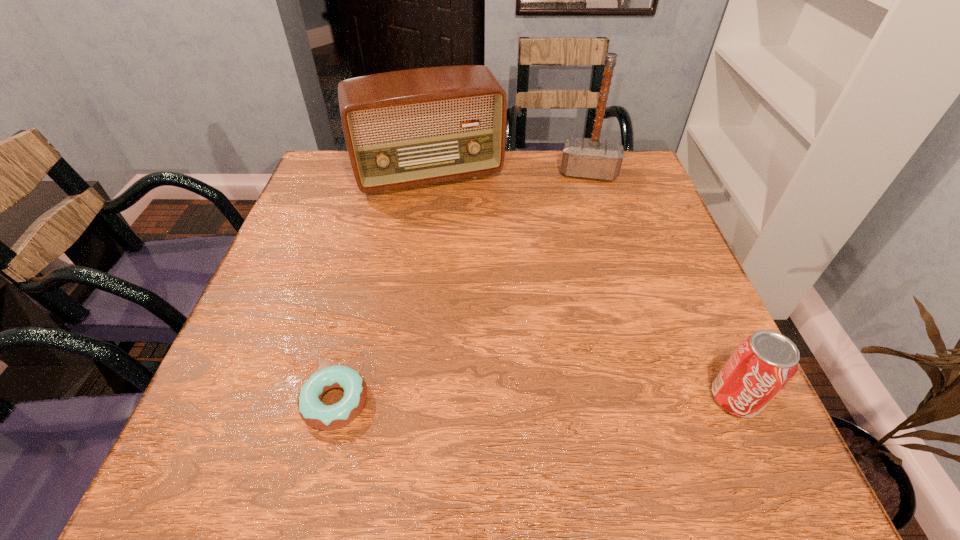
Where is `vacant spot on the desktop that is between the doughnut and the rightmost object and is positioned on the striking surface of the second object from right to left`? vacant spot on the desktop that is between the doughnut and the rightmost object and is positioned on the striking surface of the second object from right to left is located at coordinates [581, 400].

Locate an element on the screen. Image resolution: width=960 pixels, height=540 pixels. free space on the desktop that is between the shortest object and the rightmost object and is positioned on the front-facing side of the third shortest object is located at coordinates (509, 400).